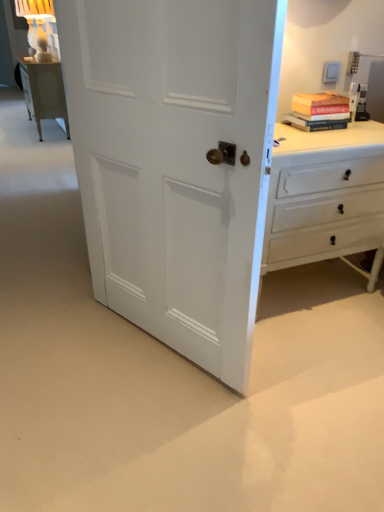
In order to click on white painted wood door at center in this screenshot , I will do `click(175, 163)`.

This screenshot has width=384, height=512. What do you see at coordinates (324, 196) in the screenshot?
I see `white painted wood chest of drawers at right` at bounding box center [324, 196].

Find the location of a particular element. This screenshot has height=512, width=384. hardcover book at upper right is located at coordinates (318, 111).

Is white painted wood chest of drawers at right in contact with white painted wood door at center?

No, white painted wood chest of drawers at right is not next to white painted wood door at center.

From the image's perspective, which one is positioned higher, white painted wood chest of drawers at right or white painted wood door at center?

From the image's view, white painted wood door at center is above.

In the scene shown: Considering the relative sizes of white painted wood chest of drawers at right and white painted wood door at center in the image provided, is white painted wood chest of drawers at right bigger than white painted wood door at center?

Indeed, white painted wood chest of drawers at right has a larger size compared to white painted wood door at center.

Is white painted wood chest of drawers at right taller or shorter than white painted wood door at center?

Clearly, white painted wood chest of drawers at right is shorter compared to white painted wood door at center.

Is hardcover book at upper right taller or shorter than white painted wood chest of drawers at right?

hardcover book at upper right is shorter than white painted wood chest of drawers at right.

Based on the photo, visually, is hardcover book at upper right positioned to the left or to the right of white painted wood chest of drawers at right?

Clearly, hardcover book at upper right is on the right of white painted wood chest of drawers at right in the image.

Which is farther, (345, 101) or (382, 205)?

The point (382, 205) is farther.

Based on the photo, from the image's perspective, would you say hardcover book at upper right is shown under white painted wood chest of drawers at right?

Incorrect, from the image's perspective, hardcover book at upper right is higher than white painted wood chest of drawers at right.

At what (x,y) coordinates should I click in order to perform the action: click on book on the right of white painted wood chest of drawers at right. Please return your answer as a coordinate pair (x, y). This screenshot has width=384, height=512. Looking at the image, I should click on (318, 111).

From the image's perspective, does white painted wood chest of drawers at right appear higher than hardcover book at upper right?

No, from the image's perspective, white painted wood chest of drawers at right is not over hardcover book at upper right.

Could you tell me if white painted wood chest of drawers at right is turned towards hardcover book at upper right?

No, white painted wood chest of drawers at right is not aimed at hardcover book at upper right.

Can you tell me how much white painted wood door at center and white painted wood chest of drawers at right differ in facing direction?

The angular difference between white painted wood door at center and white painted wood chest of drawers at right is 64.8 degrees.

How distant is white painted wood door at center from white painted wood chest of drawers at right?

white painted wood door at center and white painted wood chest of drawers at right are 57.85 centimeters apart from each other.

Is white painted wood door at center aimed at white painted wood chest of drawers at right?

No, white painted wood door at center is not aimed at white painted wood chest of drawers at right.

Consider the image. Can white painted wood chest of drawers at right be found inside white painted wood door at center?

No, white painted wood chest of drawers at right is not a part of white painted wood door at center.

Does white painted wood door at center have a larger size compared to hardcover book at upper right?

Indeed, white painted wood door at center has a larger size compared to hardcover book at upper right.

From a real-world perspective, is white painted wood door at center above or below hardcover book at upper right?

Answer: white painted wood door at center is below hardcover book at upper right.

Which is more to the left, white painted wood door at center or hardcover book at upper right?

Positioned to the left is white painted wood door at center.

Does hardcover book at upper right appear on the left side of white painted wood door at center?

Incorrect, hardcover book at upper right is not on the left side of white painted wood door at center.

The width and height of the screenshot is (384, 512). Find the location of `book above the white painted wood door at center (from the image's perspective)`. book above the white painted wood door at center (from the image's perspective) is located at coordinates (318, 111).

Who is smaller, hardcover book at upper right or white painted wood door at center?

hardcover book at upper right.

Is hardcover book at upper right aimed at white painted wood door at center?

No, hardcover book at upper right does not turn towards white painted wood door at center.

Identify the location of chest of drawers that is on the right side of white painted wood door at center. The width and height of the screenshot is (384, 512). (324, 196).

I want to click on book behind the white painted wood chest of drawers at right, so click(318, 111).

From the picture: Which object lies further to the anchor point white painted wood door at center, white painted wood chest of drawers at right or hardcover book at upper right?

Based on the image, hardcover book at upper right appears to be further to white painted wood door at center.

From the picture: Based on their spatial positions, is white painted wood door at center or hardcover book at upper right closer to white painted wood chest of drawers at right?

Based on the image, hardcover book at upper right appears to be nearer to white painted wood chest of drawers at right.

Looking at the image, which one is located closer to hardcover book at upper right, white painted wood chest of drawers at right or white painted wood door at center?

Among the two, white painted wood chest of drawers at right is located nearer to hardcover book at upper right.

Which object lies further to the anchor point white painted wood door at center, hardcover book at upper right or white painted wood chest of drawers at right?

hardcover book at upper right is further to white painted wood door at center.

Considering their positions, is white painted wood door at center positioned closer to hardcover book at upper right than white painted wood chest of drawers at right?

white painted wood chest of drawers at right.

Looking at the image, which one is located closer to white painted wood chest of drawers at right, hardcover book at upper right or white painted wood door at center?

hardcover book at upper right is closer to white painted wood chest of drawers at right.

This screenshot has height=512, width=384. I want to click on chest of drawers between white painted wood door at center and hardcover book at upper right along the z-axis, so click(x=324, y=196).